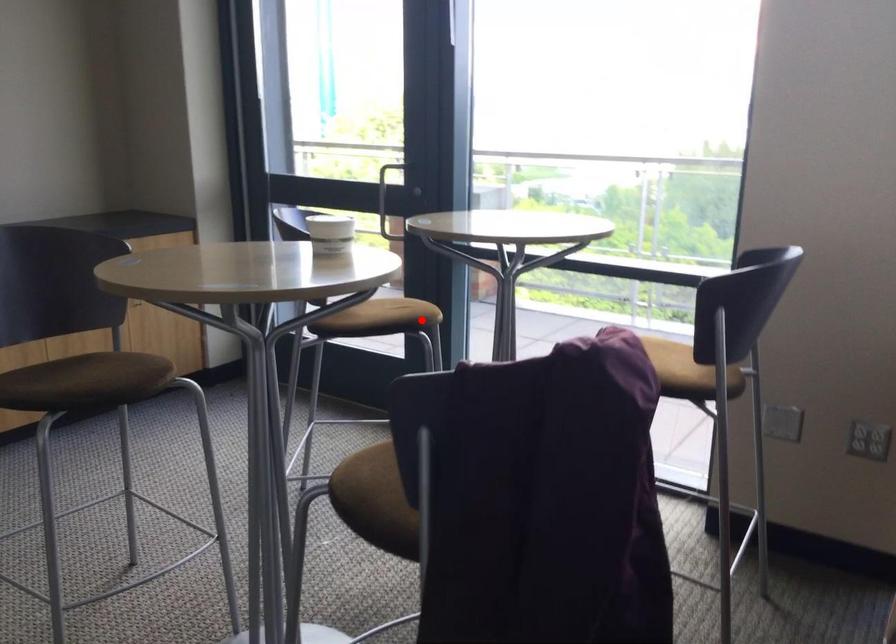
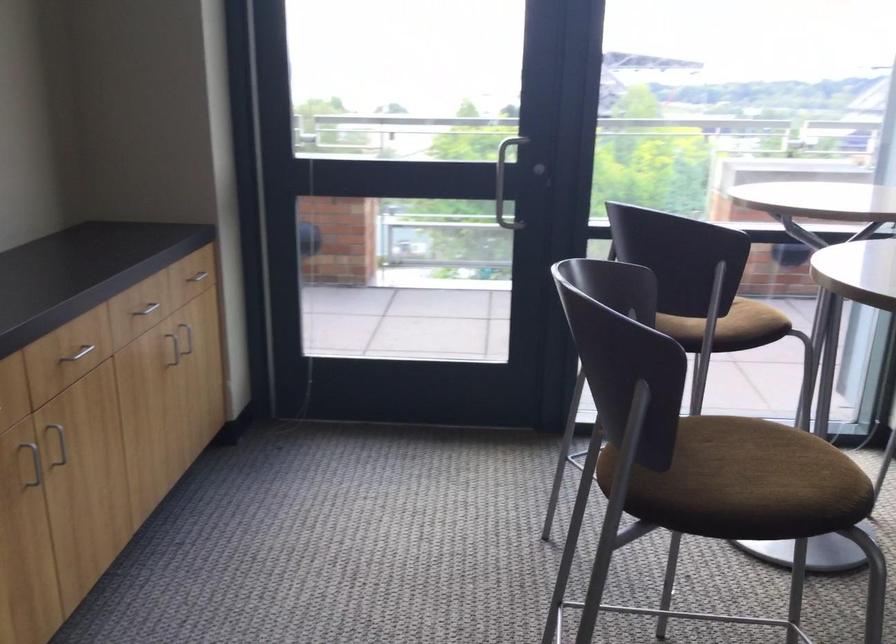
In the second image, find the point that corresponds to the highlighted location in the first image.

(748, 319)